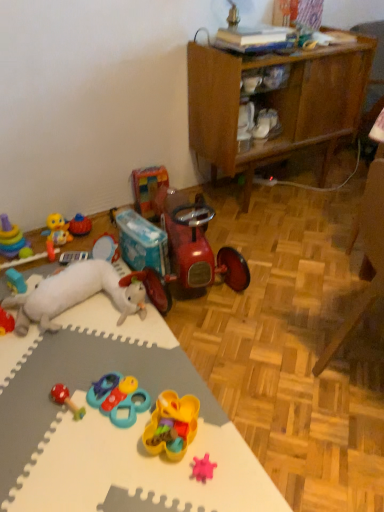
The image size is (384, 512). Find the location of `vacant area that lies between pink rubber star at lower center, placed as the twelfth toy when sorted from left to right, and translucent yellow plastic toy at center, the second toy in the right-to-left sequence`. vacant area that lies between pink rubber star at lower center, placed as the twelfth toy when sorted from left to right, and translucent yellow plastic toy at center, the second toy in the right-to-left sequence is located at coordinates (198, 449).